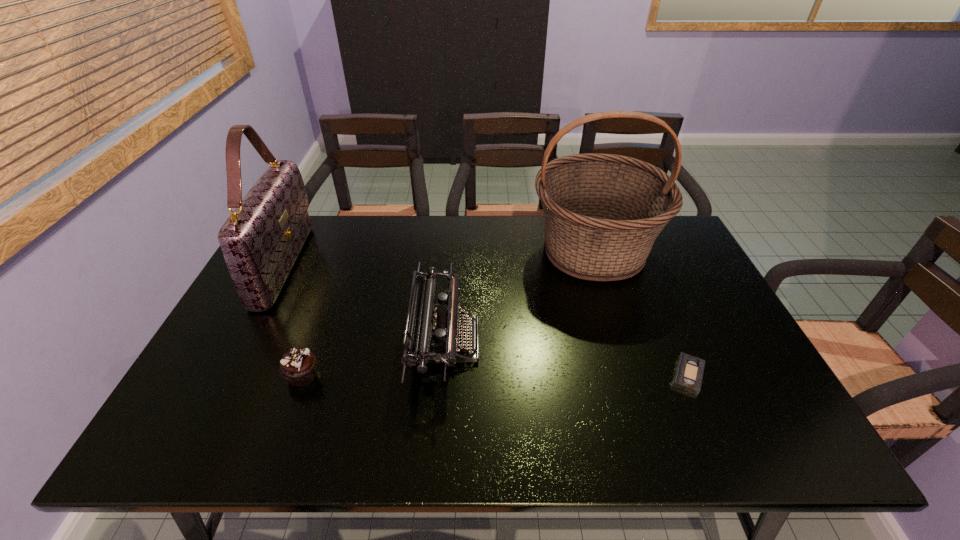
Identify the location of basket. This screenshot has height=540, width=960. (603, 212).

I want to click on the leftmost object, so click(260, 241).

This screenshot has height=540, width=960. In order to click on typewriter in this screenshot , I will do coord(430,336).

Where is `the third shortest object`? This screenshot has height=540, width=960. the third shortest object is located at coordinates (430, 336).

In order to click on cupcake in this screenshot , I will do `click(298, 366)`.

Where is `the second object from left to right`? This screenshot has width=960, height=540. the second object from left to right is located at coordinates (298, 366).

Find the location of a particular element. the shortest object is located at coordinates (689, 372).

In order to click on vacant space located on the front of the basket in this screenshot , I will do `click(645, 413)`.

The width and height of the screenshot is (960, 540). Identify the location of vacant area situated on the front of the handbag with the clasp. (384, 265).

This screenshot has width=960, height=540. What are the coordinates of `free space located 0.380m on the typing side of the third tallest object` in the screenshot? It's located at (630, 342).